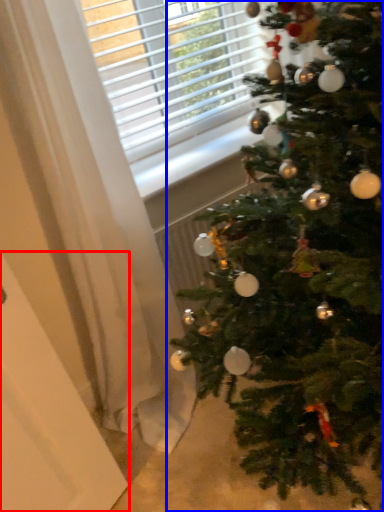
Question: Which object is further to the camera taking this photo, screen door (highlighted by a red box) or christmas tree (highlighted by a blue box)?

Choices:
 (A) screen door
 (B) christmas tree

Answer: (A)